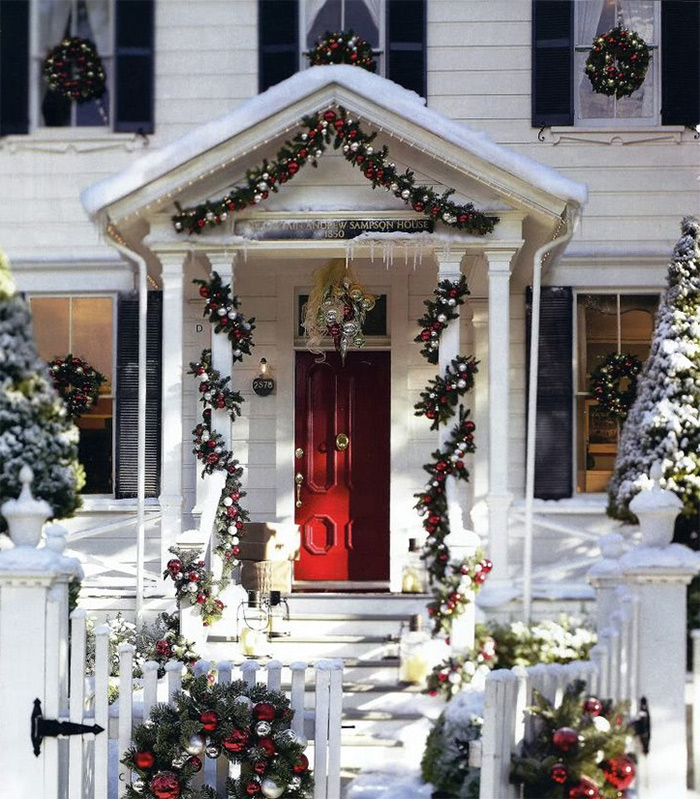
Identify the location of wreath. The width and height of the screenshot is (700, 799). (610, 62), (246, 733).